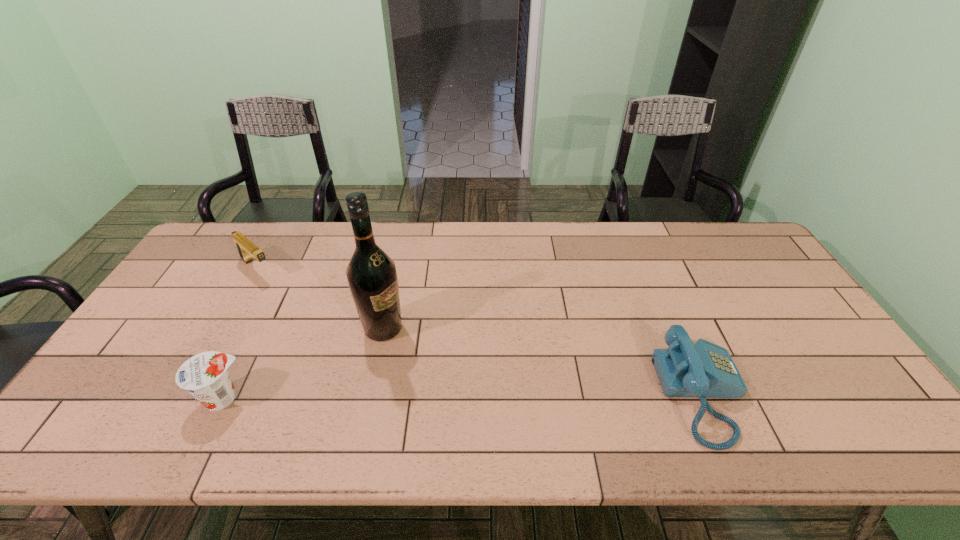
This screenshot has height=540, width=960. I want to click on vacant spot on the desktop that is between the yogurt and the telephone and is positioned on the label of the third nearest object, so click(516, 396).

Where is `vacant spot on the desktop that is between the yogurt and the rightmost object and is positioned at the barrel of the farthest object`? vacant spot on the desktop that is between the yogurt and the rightmost object and is positioned at the barrel of the farthest object is located at coordinates (404, 397).